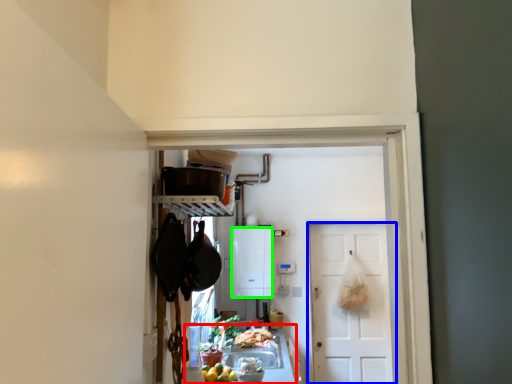
Question: Which object is positioned farthest from counter top (highlighted by a red box)? Select from door (highlighted by a blue box) and cabinetry (highlighted by a green box).

Choices:
 (A) door
 (B) cabinetry

Answer: (A)